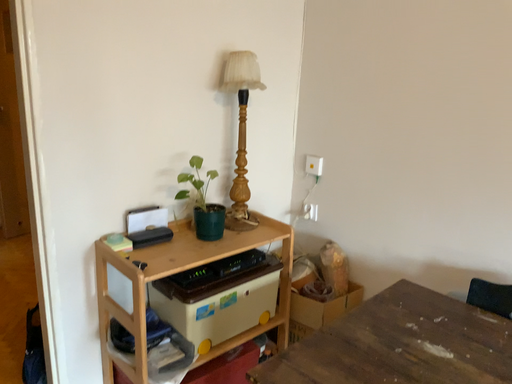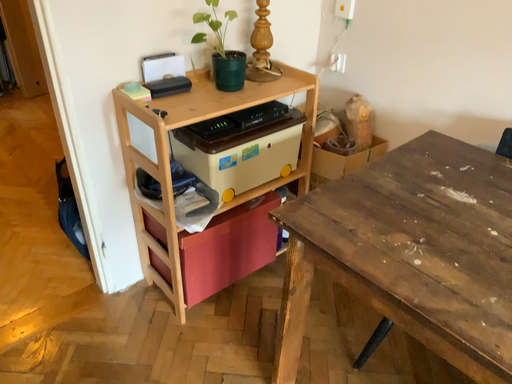
Question: How did the camera likely rotate when shooting the video?

Choices:
 (A) rotated upward
 (B) rotated downward

Answer: (B)